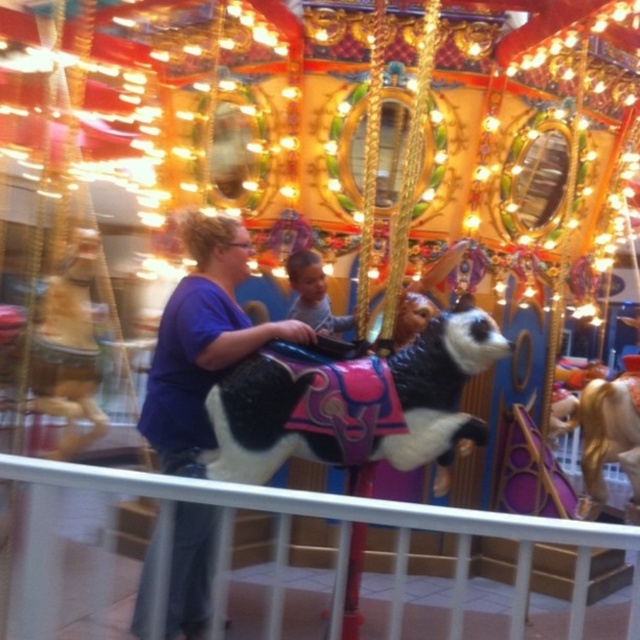
You are standing at the center of the carousel and see the point at coordinates (202, 342). According to the image, what object is located at that point?

The point at coordinates (202, 342) is on the purple cotton shirt at center.

You are a photographer at the carousel. You need to capture a photo where the purple cotton shirt at center is clearly visible without being blocked by the golden polished horse at right. Based on their positions, is this possible?

The purple cotton shirt at center is located above the golden polished horse at right, so it should be possible to capture the shirt without obstruction from the horse.

You are a parent trying to choose between the black and white plush horse at center and the golden polished horse at right for your child. Based on the height, which one would be more suitable for a taller child?

The golden polished horse at right is taller than the black and white plush horse at center, so it would be more suitable for a taller child.